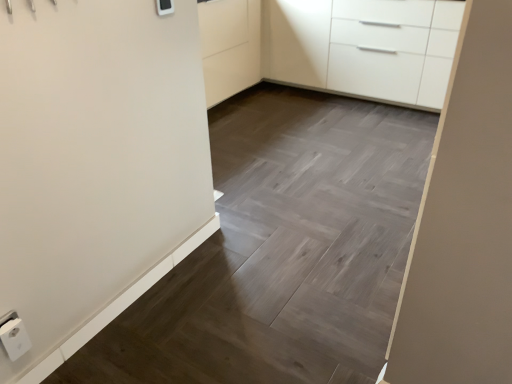
Question: Is the position of white glossy cabinet at upper right less distant than that of white plastic light switch at upper center?

Choices:
 (A) yes
 (B) no

Answer: (B)

Question: Can you confirm if white glossy cabinet at upper right is taller than white plastic light switch at upper center?

Choices:
 (A) no
 (B) yes

Answer: (B)

Question: Can you confirm if white glossy cabinet at upper right is positioned to the right of white plastic light switch at upper center?

Choices:
 (A) yes
 (B) no

Answer: (A)

Question: From a real-world perspective, does white glossy cabinet at upper right sit lower than white plastic light switch at upper center?

Choices:
 (A) no
 (B) yes

Answer: (B)

Question: Is white glossy cabinet at upper right wider than white plastic light switch at upper center?

Choices:
 (A) yes
 (B) no

Answer: (A)

Question: Is white glossy cabinet at upper right not close to white plastic light switch at upper center?

Choices:
 (A) no
 (B) yes

Answer: (B)

Question: Is white plastic electric outlet at lower left taller than white glossy cabinet at upper right?

Choices:
 (A) yes
 (B) no

Answer: (B)

Question: Does white plastic electric outlet at lower left have a lesser height compared to white glossy cabinet at upper right?

Choices:
 (A) no
 (B) yes

Answer: (B)

Question: Would you say white glossy cabinet at upper right is part of white plastic electric outlet at lower left's contents?

Choices:
 (A) no
 (B) yes

Answer: (A)

Question: Is white plastic electric outlet at lower left oriented away from white glossy cabinet at upper right?

Choices:
 (A) yes
 (B) no

Answer: (B)

Question: From the image's perspective, is white plastic electric outlet at lower left under white glossy cabinet at upper right?

Choices:
 (A) yes
 (B) no

Answer: (A)

Question: Are white plastic electric outlet at lower left and white glossy cabinet at upper right making contact?

Choices:
 (A) no
 (B) yes

Answer: (A)

Question: Are white plastic light switch at upper center and white plastic electric outlet at lower left far apart?

Choices:
 (A) yes
 (B) no

Answer: (A)